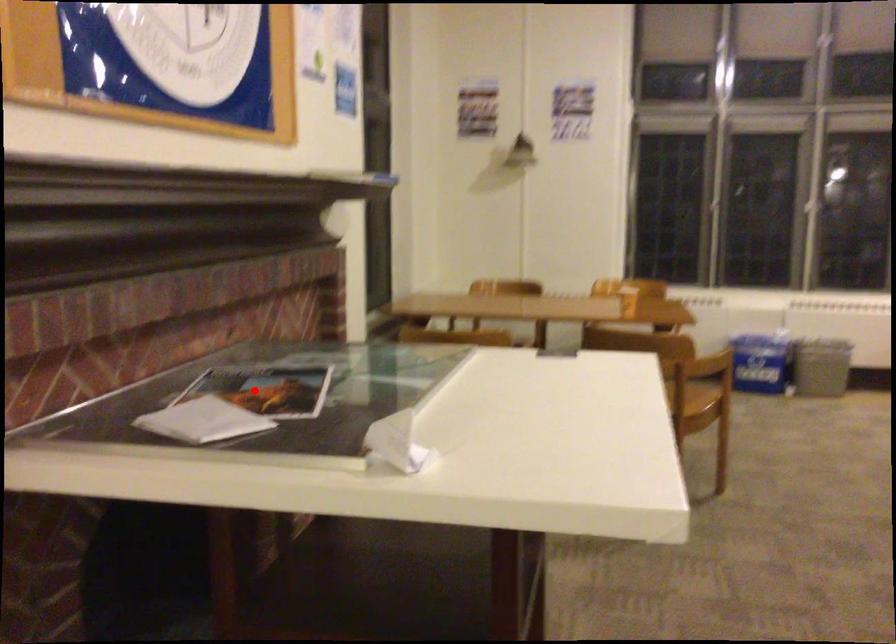
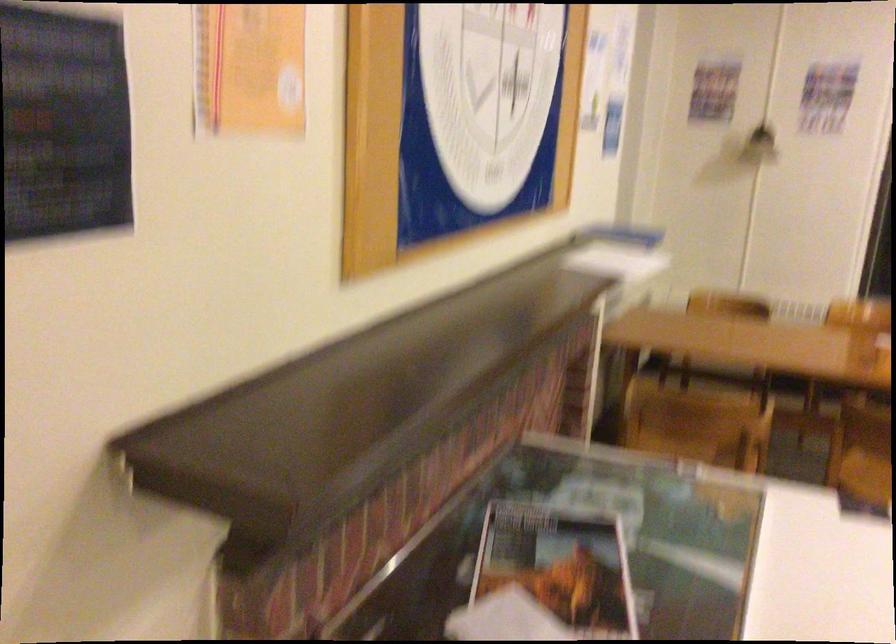
The point at the highlighted location is marked in the first image. Where is the corresponding point in the second image?

(560, 565)